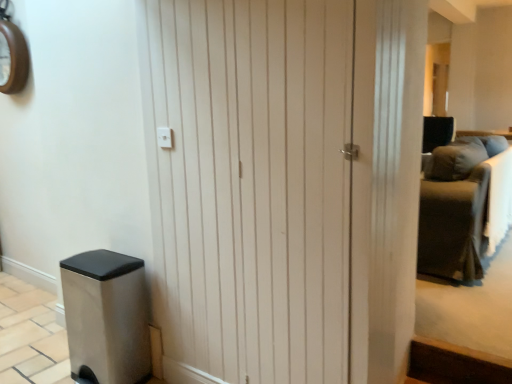
This screenshot has width=512, height=384. In order to click on blank area beneath wooden clock at upper left (from a real-world perspective) in this screenshot , I will do `click(31, 288)`.